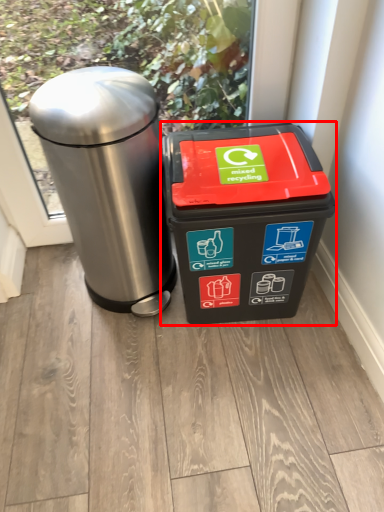
Question: Where is waste container (annotated by the red box) located in relation to waste container in the image?

Choices:
 (A) left
 (B) right

Answer: (B)